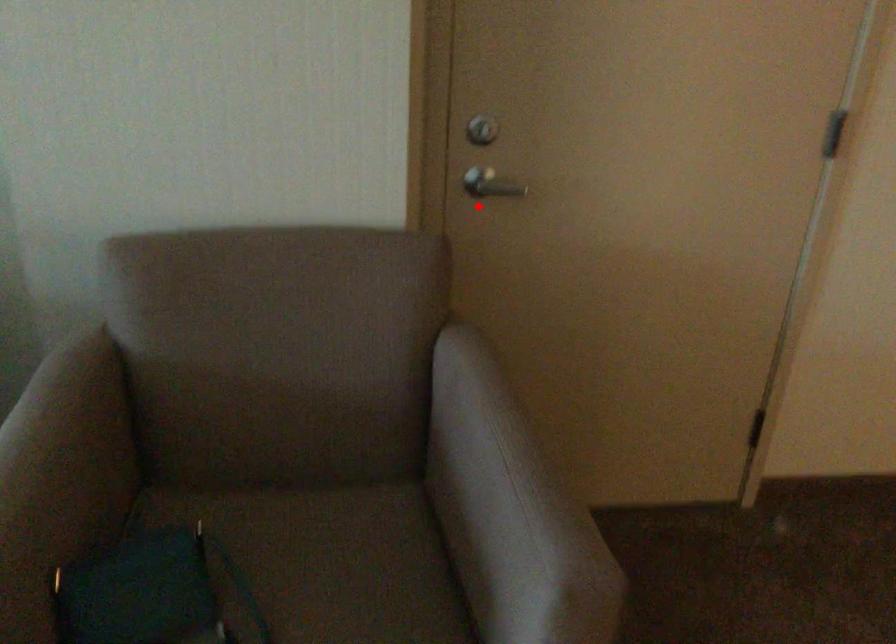
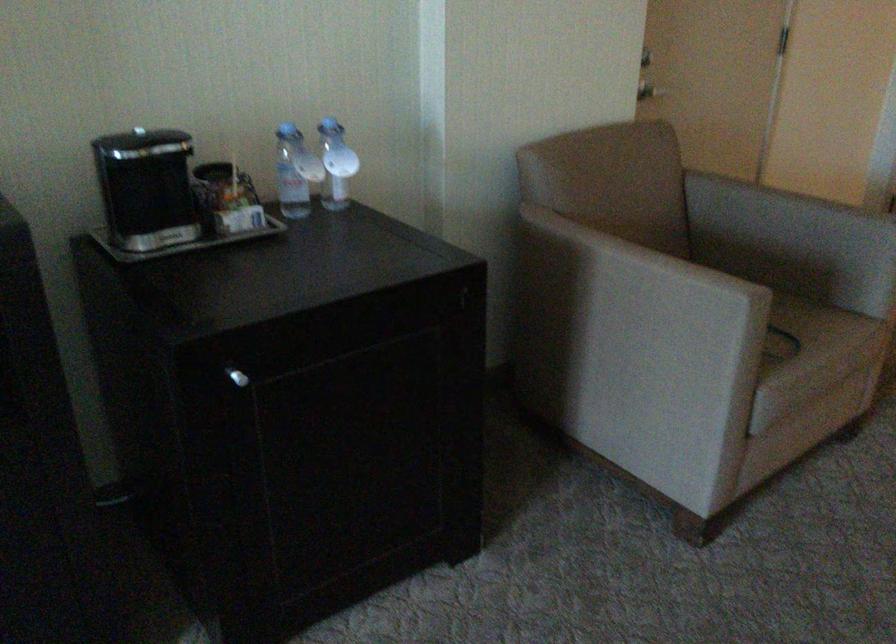
The point at the highlighted location is marked in the first image. Where is the corresponding point in the second image?

(649, 90)